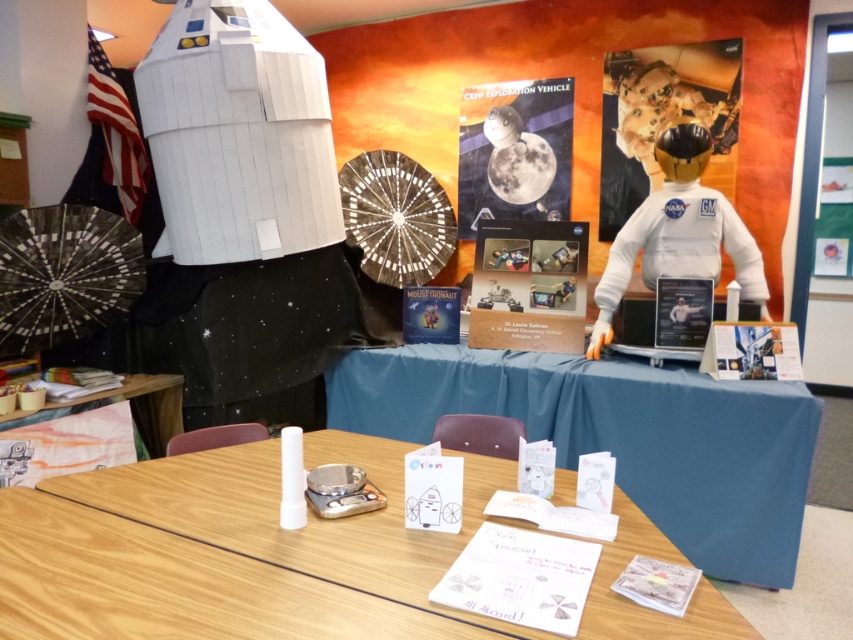
You are standing in front of the space display and want to locate two specific points marked on the table. The first point is at coordinates point [664,124] and the second is at point [173,419]. From your perspective, which point is closer to you?

Point [173,419] is closer to you because the description states that point [664,124] is behind point [173,419].

You are at the space display and want to locate the white fabric astronaut at right and the wooden table at lower left. Which one is positioned to the right side of the other?

The white fabric astronaut at right is to the right of the wooden table at lower left.